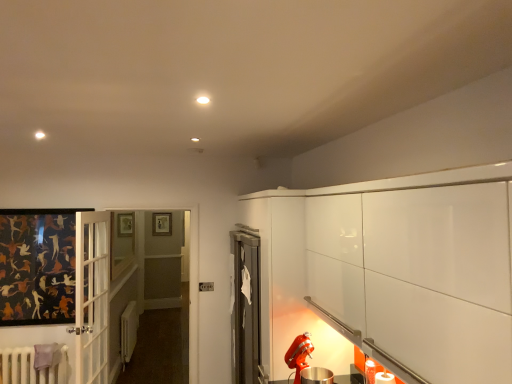
Question: Relative to clear glass window at center, is white matte radiator at lower left, the first radiator positioned from the back, in front or behind?

Choices:
 (A) front
 (B) behind

Answer: (B)

Question: Looking at the image, does white matte radiator at lower left, the first radiator positioned from the back, seem bigger or smaller compared to clear glass window at center?

Choices:
 (A) small
 (B) big

Answer: (B)

Question: Which of these objects is positioned farthest from the wooden picture frame at upper center?

Choices:
 (A) clear glass window at center
 (B) white matte radiator at lower left, marked as the 2th radiator in a front-to-back arrangement
 (C) white painted radiator at lower left, the 2th radiator from the back

Answer: (C)

Question: Considering the real-world distances, which object is farthest from the white painted radiator at lower left, the 2th radiator from the back?

Choices:
 (A) wooden picture frame at upper center
 (B) clear glass window at center
 (C) white matte radiator at lower left, marked as the 2th radiator in a front-to-back arrangement

Answer: (A)